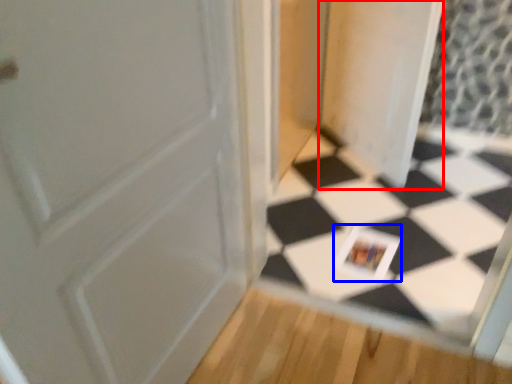
Question: Which object is closer to the camera taking this photo, screen door (highlighted by a red box) or postcard (highlighted by a blue box)?

Choices:
 (A) screen door
 (B) postcard

Answer: (A)